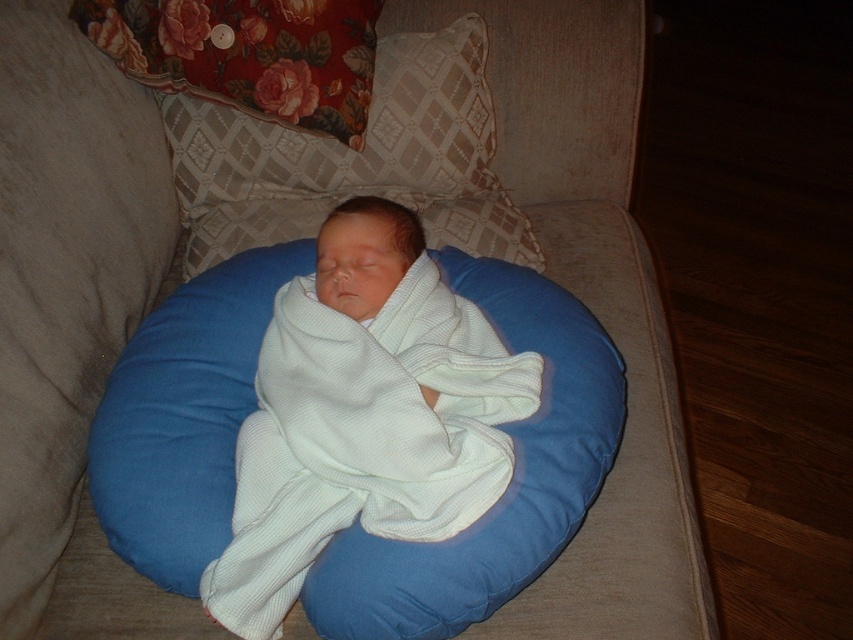
You are a photographer setting up a shoot in this room. You need to place a small lamp between the white waffle fabric newborn at center and the white soft pillow at center. Since the newborn is taller, where should you place the lamp to ensure it doesn

The white waffle fabric newborn at center is taller than the white soft pillow at center. To ensure the lamp is placed appropriately between them, position it closer to the white soft pillow at center since the newborn is taller and might block the light if the lamp is placed too close.

You are a photographer taking a closeup shot of the baby in the image. You want to focus on the area at point (x=364, y=413). According to the scene description, what object is located at this point?

The point (x=364, y=413) is on the white waffle fabric newborn at center, so the photographer should focus on the white waffle fabric newborn at center.